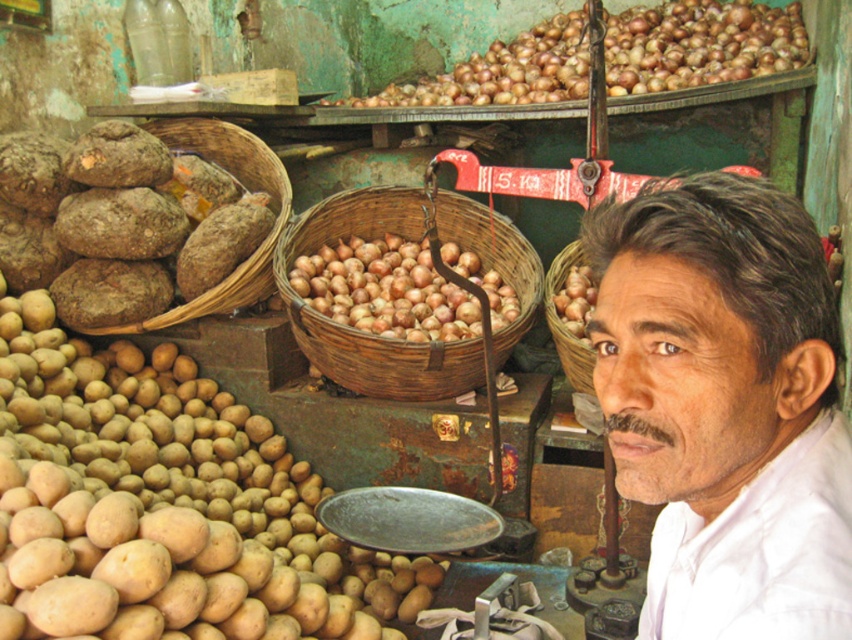
From the picture: You are standing at the position of the man in the market scene. There are two points marked in the image. The first point is at coordinates point (372,337) and the second is at point (548,314). Which point is closer to you?

Point (372,337) is closer to you because it is in front of point (548,314).

You are a customer at the market and want to buy the produce located at point (389, 360) and point (338, 252). The vendor says you can only carry one basket at a time. Which point should you approach first if you want to reach the one closer to you first?

You should approach point (389, 360) first because it is in front of point (338, 252), meaning it is closer to you.